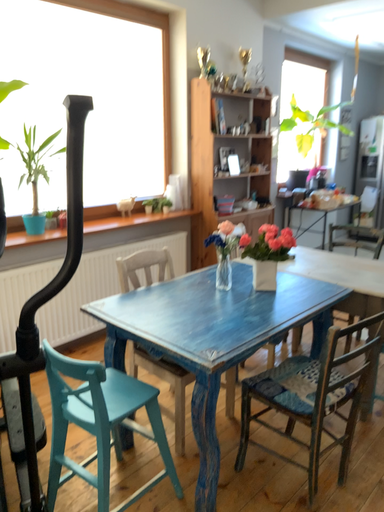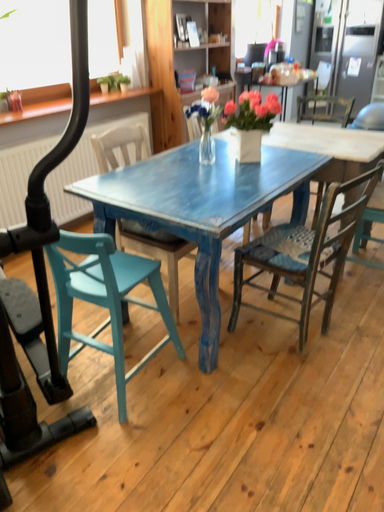
Question: How did the camera likely rotate when shooting the video?

Choices:
 (A) rotated right
 (B) rotated left

Answer: (A)